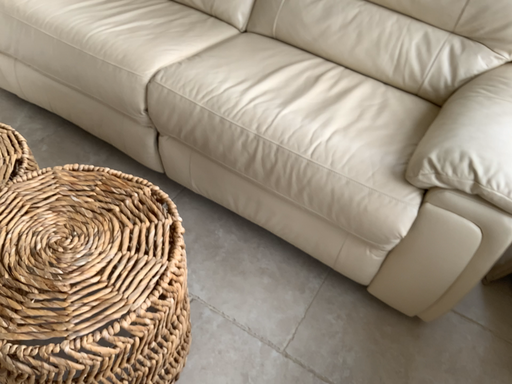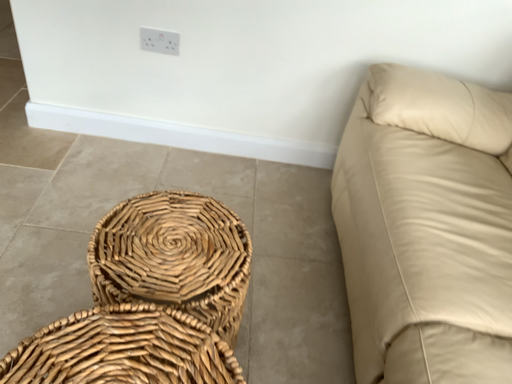
Question: How did the camera likely rotate when shooting the video?

Choices:
 (A) rotated left
 (B) rotated right

Answer: (A)